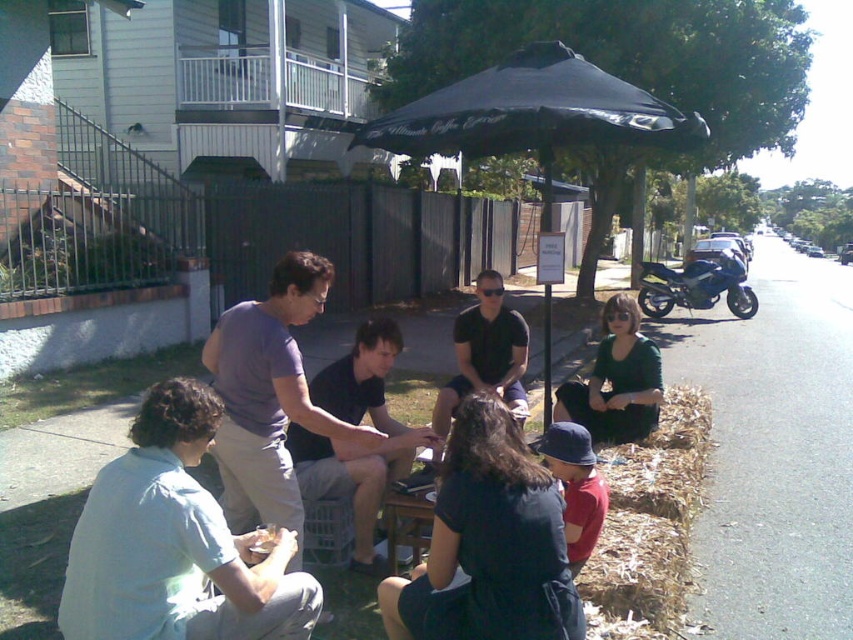
At what (x,y) coordinates should I click in order to perform the action: click on red cotton shirt at lower center. Please return your answer as a coordinate pair (x, y). Looking at the image, I should click on (576, 486).

Does point (601, 513) come behind point (408, 540)?

No, it is not.

The height and width of the screenshot is (640, 853). Find the location of `red cotton shirt at lower center`. red cotton shirt at lower center is located at coordinates (576, 486).

Who is taller, red cotton shirt at lower center or shiny blue motorcycle at right?

shiny blue motorcycle at right

I want to click on red cotton shirt at lower center, so (x=576, y=486).

The image size is (853, 640). What do you see at coordinates (616, 380) in the screenshot?
I see `matte green shirt at lower center` at bounding box center [616, 380].

Does matte green shirt at lower center have a smaller size compared to red cotton shirt at lower center?

No, matte green shirt at lower center is not smaller than red cotton shirt at lower center.

Is point (659, 381) less distant than point (560, 451)?

No.

You are a GUI agent. You are given a task and a screenshot of the screen. Output one action in this format:
    pyautogui.click(x=<x>, y=<y>)
    Task: Click on the matte green shirt at lower center
    This screenshot has width=853, height=640.
    Given the screenshot: What is the action you would take?
    pyautogui.click(x=616, y=380)